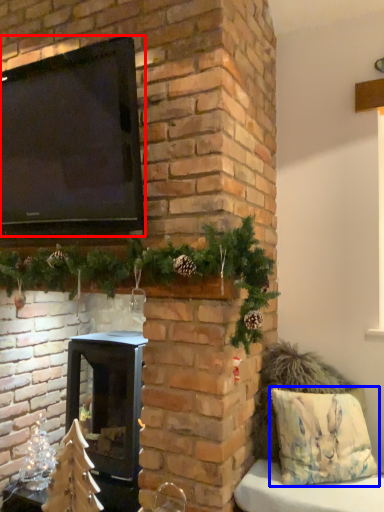
Question: Among these objects, which one is nearest to the camera, window screen (highlighted by a red box) or pillow (highlighted by a blue box)?

Choices:
 (A) window screen
 (B) pillow

Answer: (A)